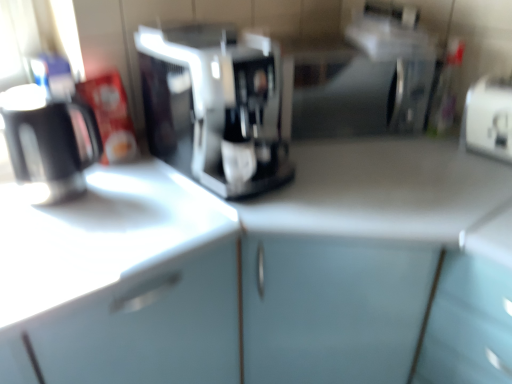
The image size is (512, 384). Find the location of `vacant space that is in between white plastic toaster at right and sleek silver coffee maker at center`. vacant space that is in between white plastic toaster at right and sleek silver coffee maker at center is located at coordinates (378, 160).